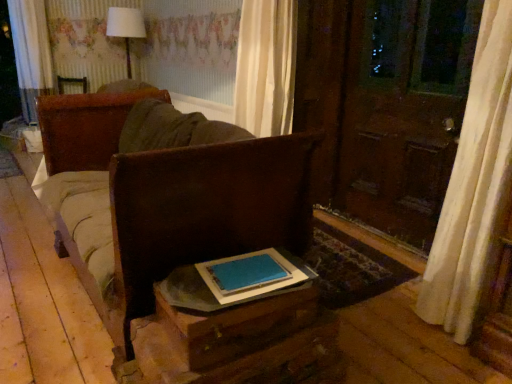
Question: From a real-world perspective, is brown leather couch at center positioned above or below white fabric lampshade at upper center?

Choices:
 (A) above
 (B) below

Answer: (B)

Question: In the image, is brown leather couch at center on the left side or the right side of white fabric lampshade at upper center?

Choices:
 (A) right
 (B) left

Answer: (A)

Question: Estimate the real-world distances between objects in this image. Which object is farther from the brown leather couch at center?

Choices:
 (A) white fabric lampshade at upper center
 (B) blue matte book at center
 (C) wooden table at lower center

Answer: (A)

Question: Considering the real-world distances, which object is closest to the blue matte book at center?

Choices:
 (A) brown leather couch at center
 (B) wooden table at lower center
 (C) white fabric lampshade at upper center

Answer: (B)